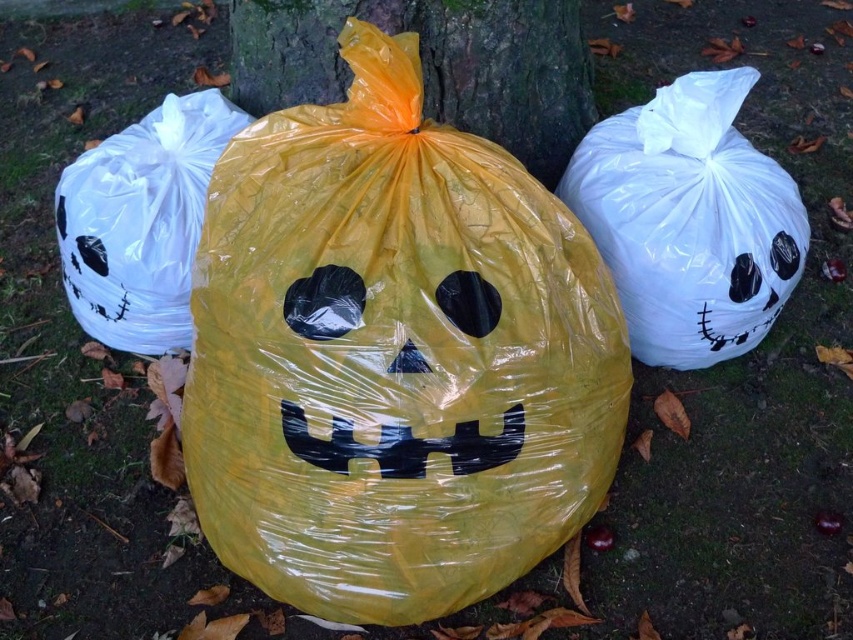
You are standing in front of the three Halloween trash bags. You need to place a new small pumpkin decoration between the white glossy trash bag at right and the white plastic bag at left. According to their positions, where should you place the pumpkin so it is between them?

The white glossy trash bag at right is positioned under the white plastic bag at left, so you should place the pumpkin between them by positioning it below the white plastic bag at left and above the white glossy trash bag at right.

You are a delivery person trying to place a small box between the yellow plastic bag at center and the white glossy trash bag at right. The box is 18 inches long. Can you fit the box between them without moving the bags?

The distance between the yellow plastic bag at center and the white glossy trash bag at right is 17.75 inches. Since the box is 18 inches long, it is slightly longer than the available space, so it won measurements. You cannot fit the box between them without moving the bags.